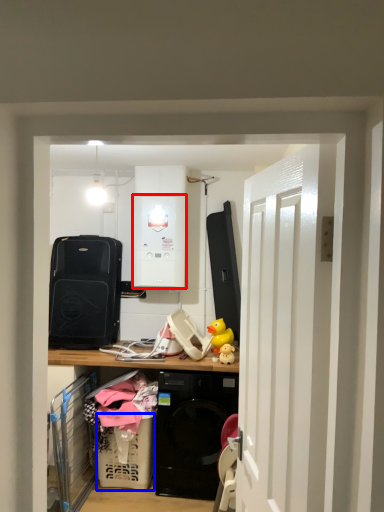
Question: Which object is closer to the camera taking this photo, appliance (highlighted by a red box) or basket (highlighted by a blue box)?

Choices:
 (A) appliance
 (B) basket

Answer: (B)